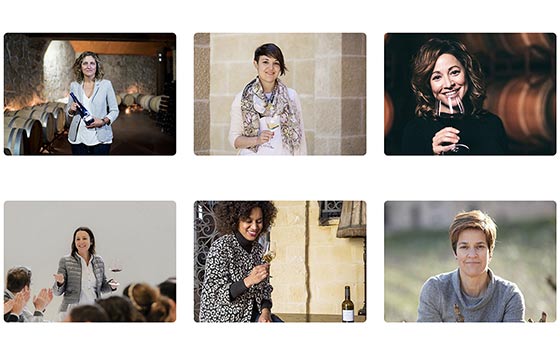
This screenshot has width=560, height=356. I want to click on drinking glasses, so click(113, 264), click(272, 118), click(270, 251), click(450, 106).